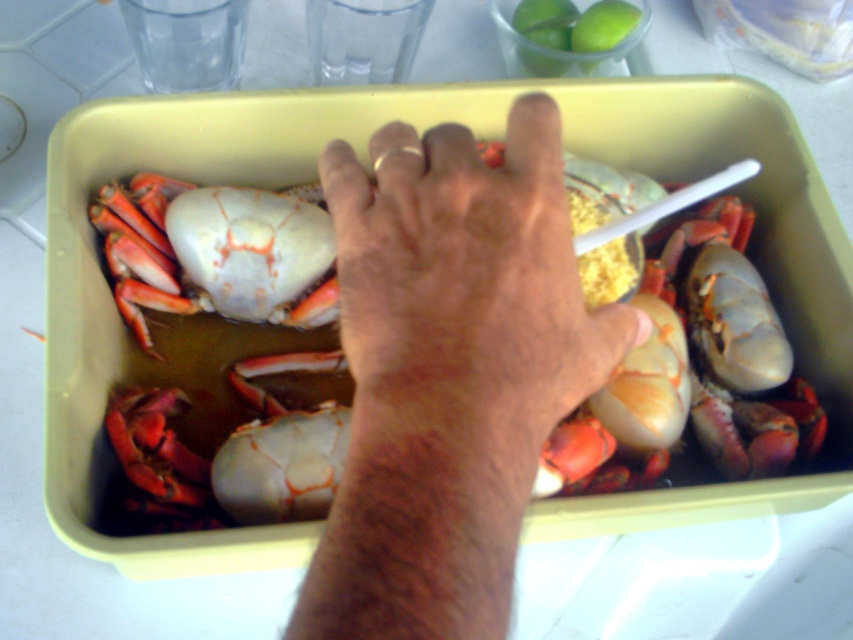
Measure the distance between point (408, 608) and camera.

Point (408, 608) is 12.30 inches from camera.

Between point (444, 321) and point (247, 273), which one is positioned in front?

Point (444, 321) is in front.

This screenshot has width=853, height=640. In order to click on dry skin hand at center in this screenshot , I will do `click(450, 372)`.